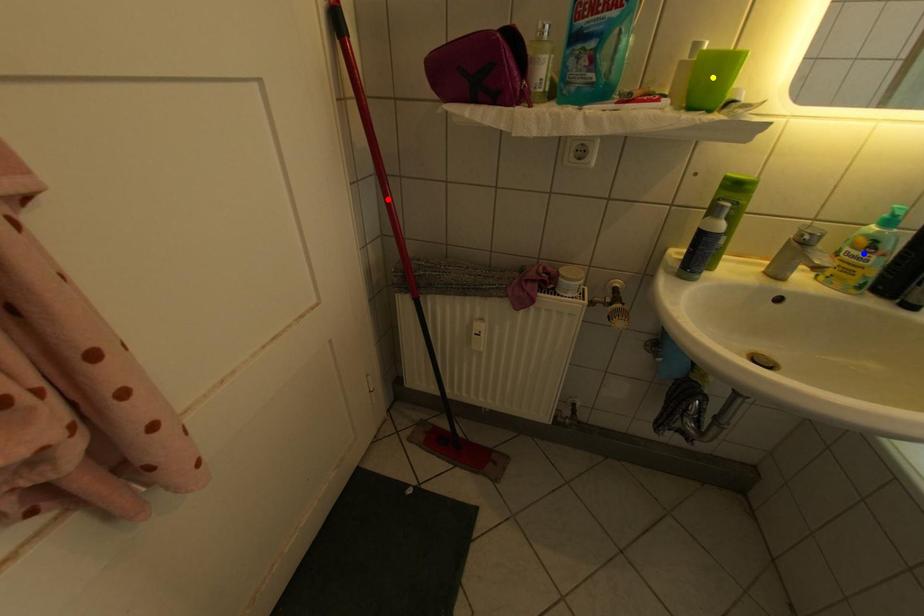
Order these from nearest to farthest:
red point | yellow point | blue point

yellow point → blue point → red point